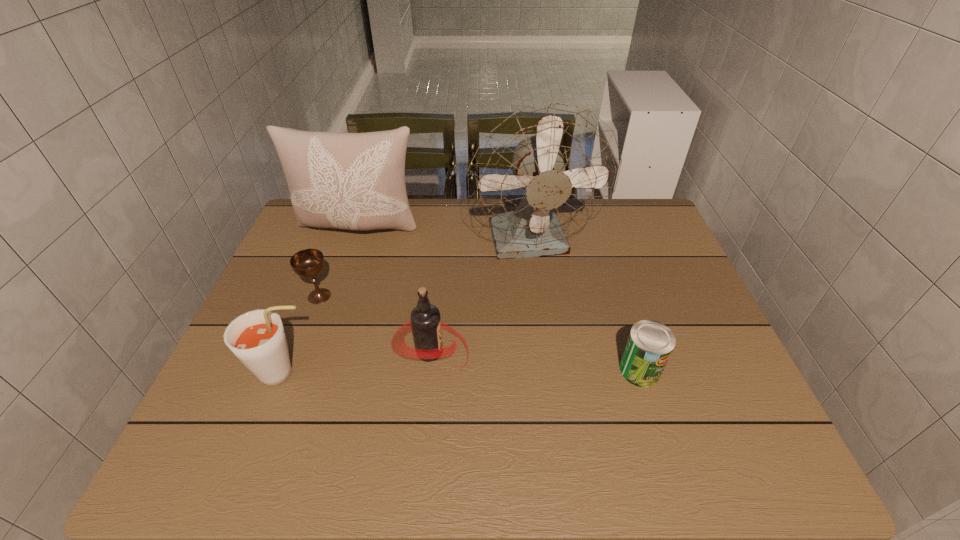
Where is `free space between the left root beer and the fan`? This screenshot has width=960, height=540. free space between the left root beer and the fan is located at coordinates [408, 309].

Image resolution: width=960 pixels, height=540 pixels. What are the coordinates of `vacant point located between the chalice and the tallest object` in the screenshot? It's located at (426, 270).

This screenshot has height=540, width=960. What are the coordinates of `the fourth closest object to the fifth shortest object` in the screenshot? It's located at (257, 338).

Locate which object is the third closest to the can. Please provide its 2D coordinates. Your answer should be formatted as a tuple, i.e. [(x, y)], where the tuple contains the x and y coordinates of a point satisfying the conditions above.

[(356, 181)]

At what (x,y) coordinates should I click in order to perform the action: click on free space that satisfies the following two spatial constraints: 1. on the front side of the cushion; 2. on the left side of the can. Please return your answer as a coordinate pair (x, y). The height and width of the screenshot is (540, 960). Looking at the image, I should click on (313, 369).

This screenshot has width=960, height=540. I want to click on free point that satisfies the following two spatial constraints: 1. on the front side of the fifth shortest object; 2. on the drink side of the left root beer, so click(311, 374).

Where is `blank space that satisfies the following two spatial constraints: 1. on the front side of the second tallest object; 2. on the left side of the can`? The image size is (960, 540). blank space that satisfies the following two spatial constraints: 1. on the front side of the second tallest object; 2. on the left side of the can is located at coordinates (313, 369).

Where is `free point that satisfies the following two spatial constraints: 1. on the front side of the can; 2. on the right side of the fourth nearest object`? free point that satisfies the following two spatial constraints: 1. on the front side of the can; 2. on the right side of the fourth nearest object is located at coordinates (292, 369).

I want to click on blank space that satisfies the following two spatial constraints: 1. on the front side of the can; 2. on the drink side of the left root beer, so click(x=641, y=374).